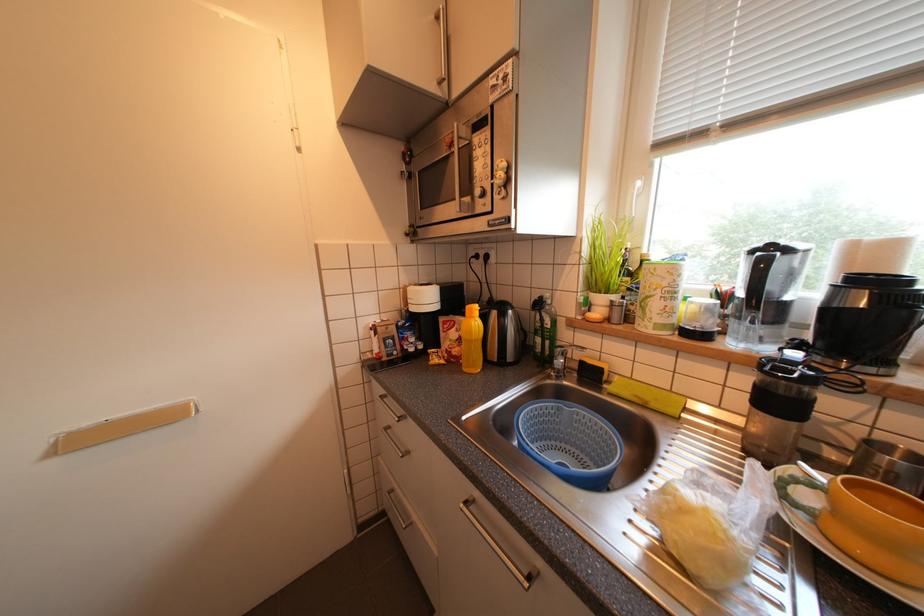
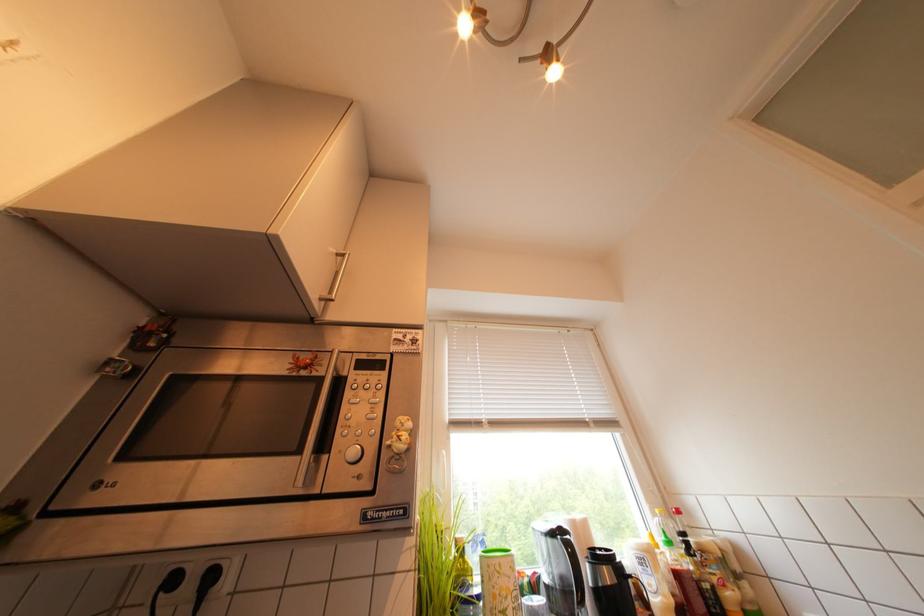
How did the camera likely rotate?

The camera's rotation is toward right-up.